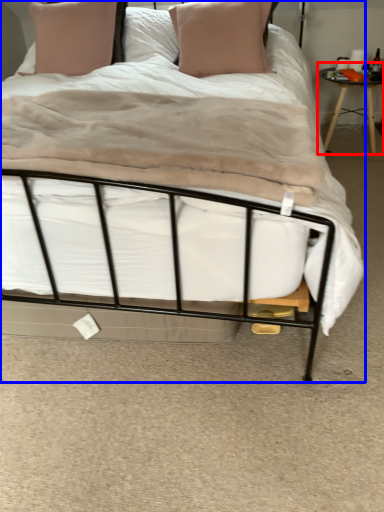
Question: Which of the following is the closest to the observer, table (highlighted by a red box) or bed (highlighted by a blue box)?

Choices:
 (A) table
 (B) bed

Answer: (B)